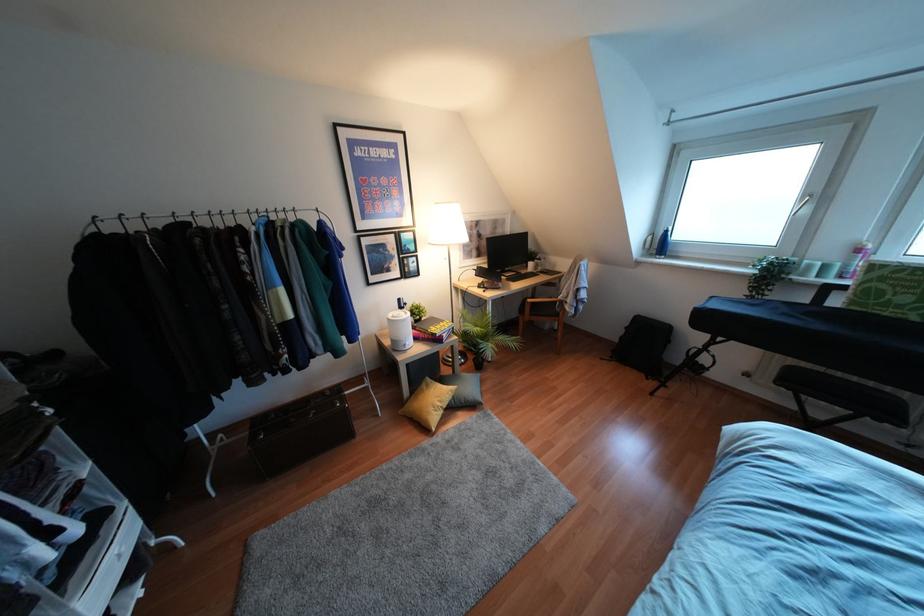
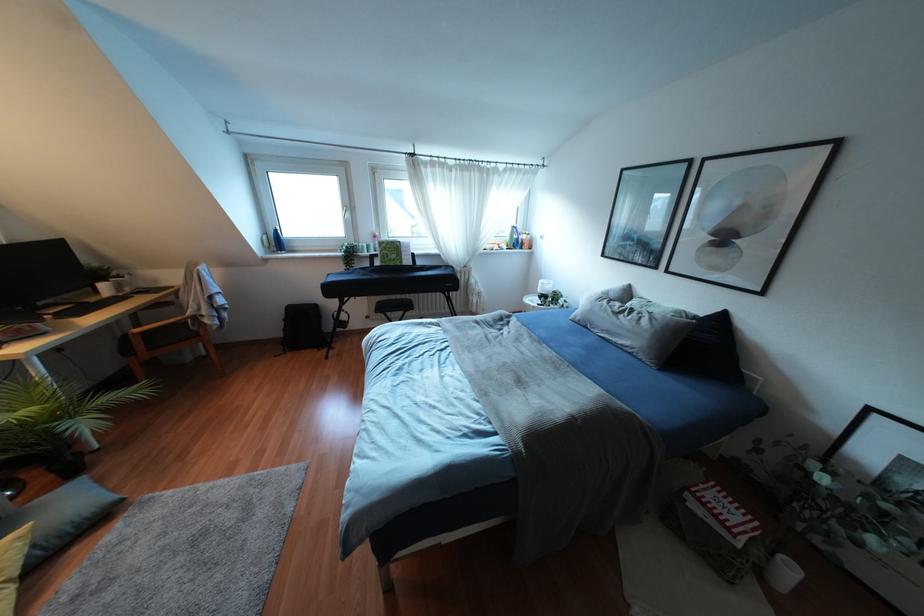
Question: I am providing you with two images of the same scene from different viewpoints. Please identify which objects are invisible in image2.

Choices:
 (A) black backpack
 (B) green music book
 (C) black chair seat
 (D) none of these

Answer: (D)